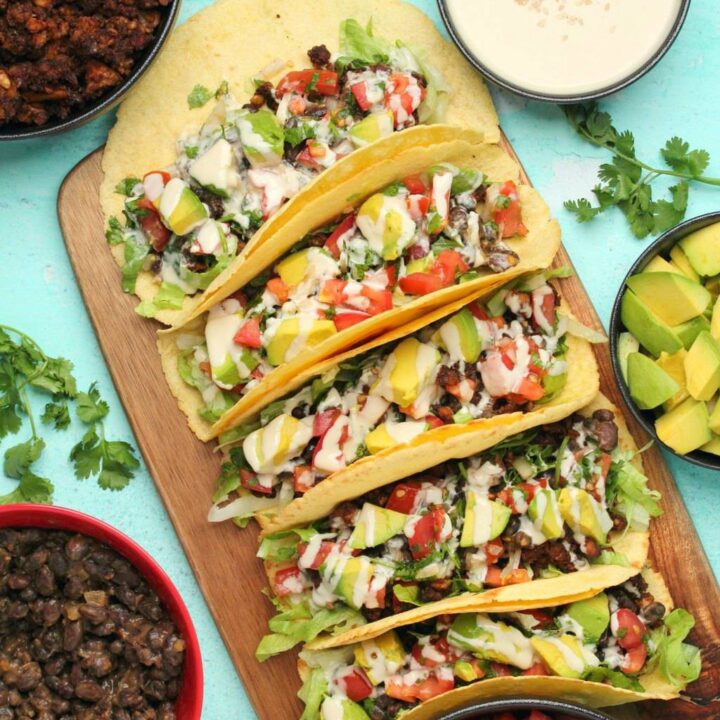
Identify the location of sauce bowl. (577, 34).